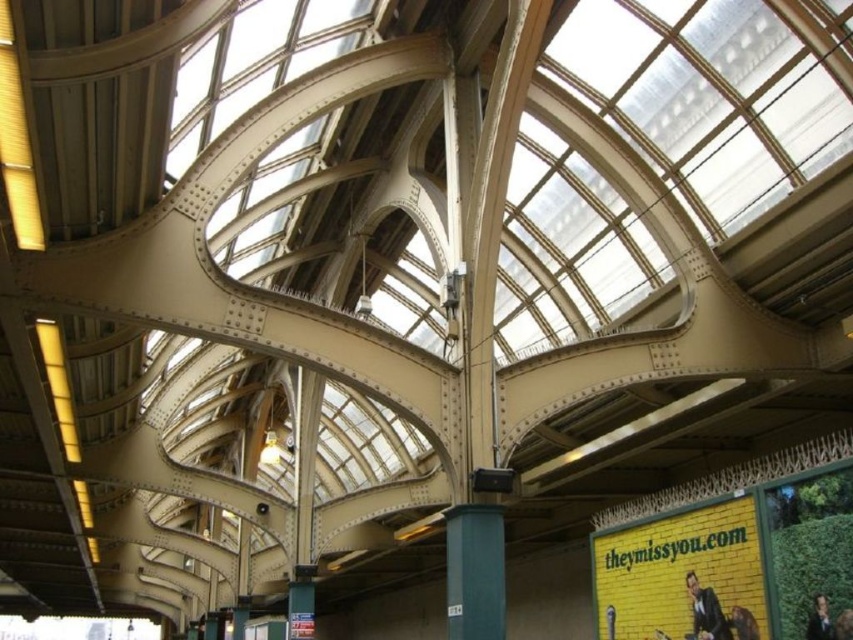
A person is standing at point (705, 611) in the image. What is the color of their clothing?

The dark suit at lower right is represented by point (705, 611), so the person is wearing a dark suit.

You are standing at the entrance of the grand historic building and see a person wearing a dark suit at lower right. If you want to approach them, in which direction should you move relative to your current position?

To approach the dark suit at lower right, you should move towards the lower right direction since that is where the dark suit at lower right is located.